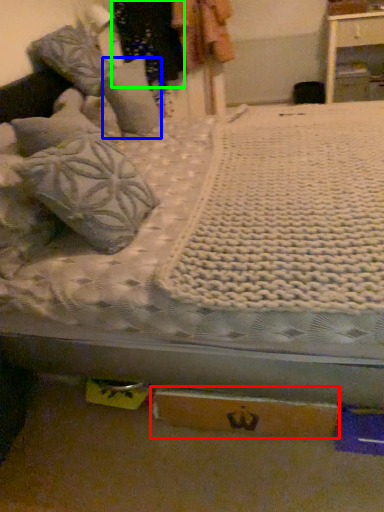
Question: Which object is the farthest from cardboard box (highlighted by a red box)? Choose among these: pillow (highlighted by a blue box) or clothing (highlighted by a green box).

Choices:
 (A) pillow
 (B) clothing

Answer: (B)